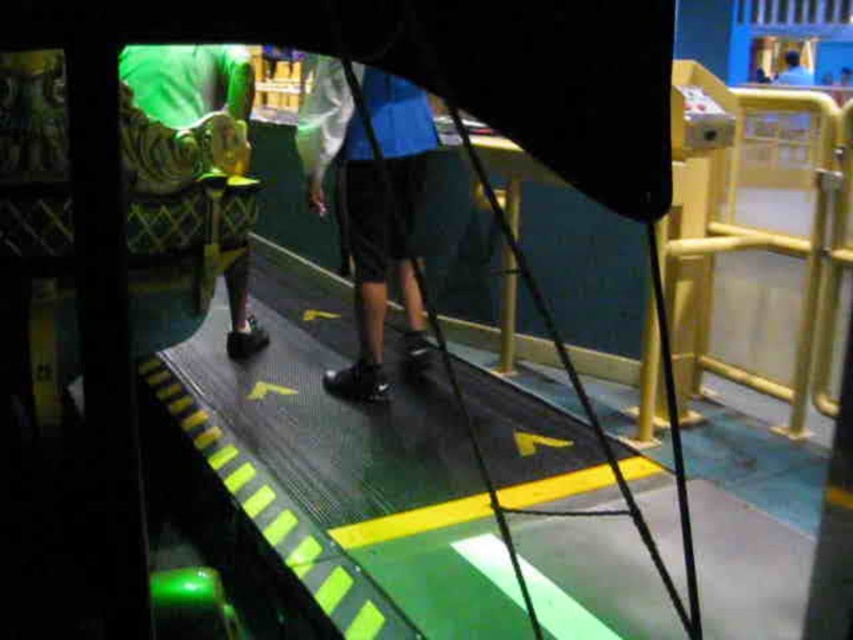
Question: Which point is closer to the camera?

Choices:
 (A) (326, 147)
 (B) (241, 84)

Answer: (A)

Question: Does shiny black shoes at center come in front of green quilted fabric at left?

Choices:
 (A) yes
 (B) no

Answer: (A)

Question: Which point is farther to the camera?

Choices:
 (A) shiny black shoes at center
 (B) green quilted fabric at left

Answer: (B)

Question: Can you confirm if shiny black shoes at center is wider than green quilted fabric at left?

Choices:
 (A) yes
 (B) no

Answer: (A)

Question: Can you confirm if shiny black shoes at center is bigger than green quilted fabric at left?

Choices:
 (A) yes
 (B) no

Answer: (A)